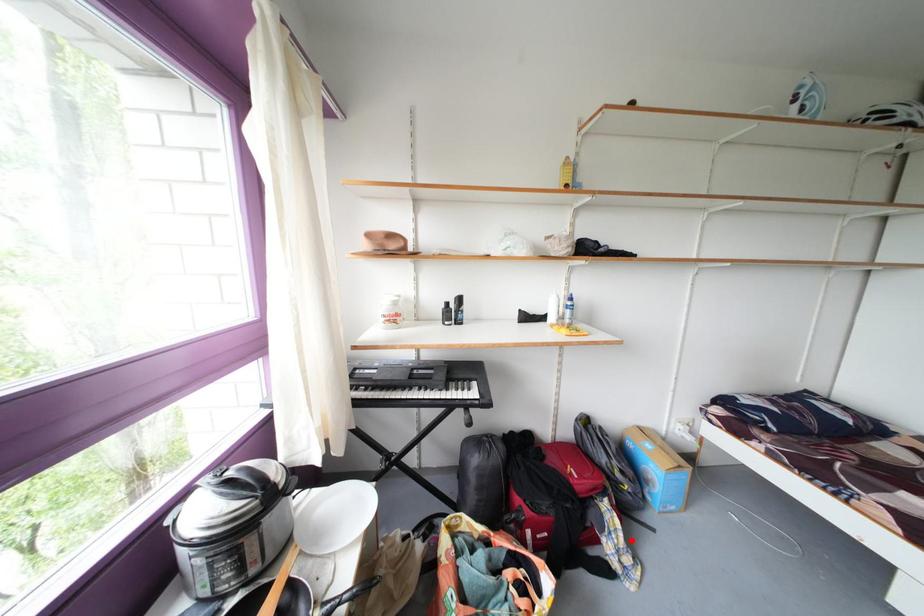
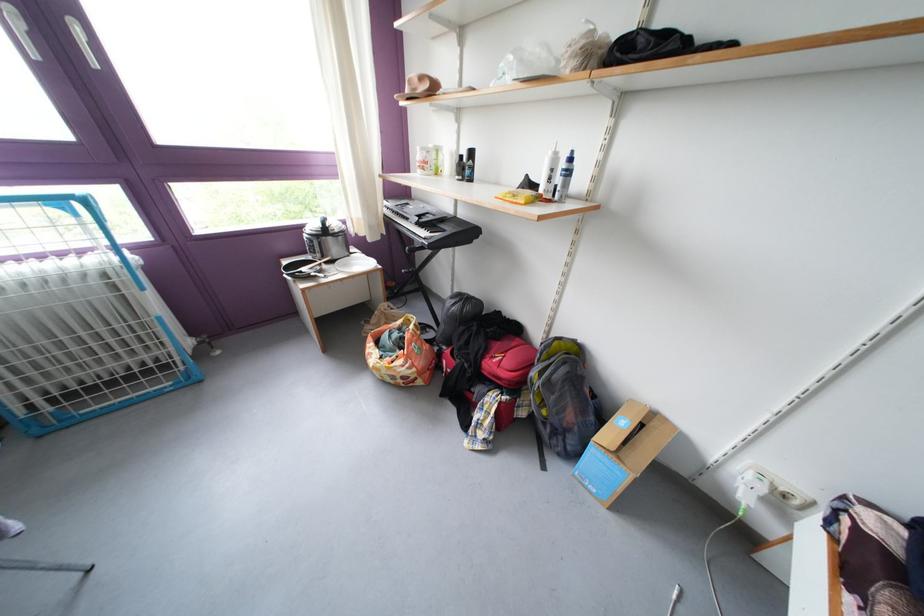
In the second image, find the point that corresponds to the highlighted location in the first image.

(500, 426)